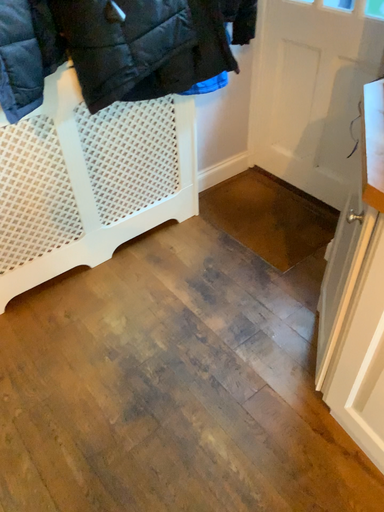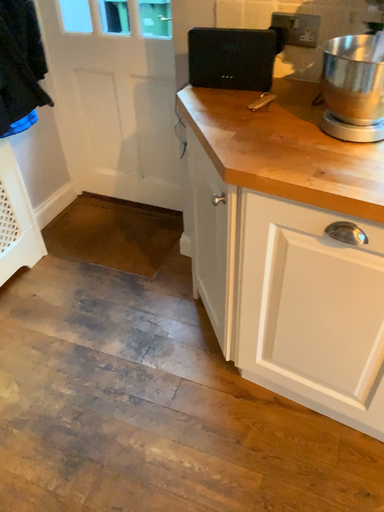
Question: Which way did the camera rotate in the video?

Choices:
 (A) rotated downward
 (B) rotated upward

Answer: (B)